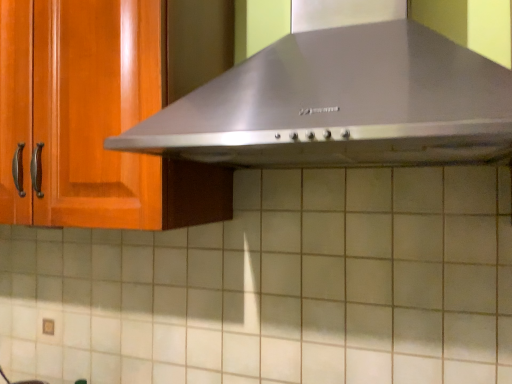
The height and width of the screenshot is (384, 512). What do you see at coordinates (341, 104) in the screenshot?
I see `stainless steel range hood at upper center` at bounding box center [341, 104].

Measure the distance between point [317,103] and camera.

Point [317,103] is 22.52 inches away from camera.

You are a GUI agent. You are given a task and a screenshot of the screen. Output one action in this format:
    pyautogui.click(x=<x>, y=<y>)
    Task: Click on the stainless steel range hood at upper center
    
    Given the screenshot: What is the action you would take?
    pyautogui.click(x=341, y=104)

What are the coordinates of `stainless steel range hood at upper center` in the screenshot? It's located at (341, 104).